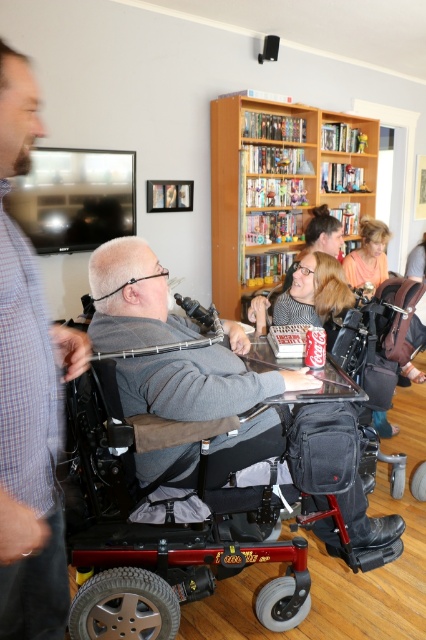
You are a photographer trying to capture a clear photo of the gray fabric wheelchair at center without the gray plaid shirt at left blocking it. What should you do?

Move to the right side of the gray plaid shirt at left so that the gray plaid shirt at left is no longer in front of the gray fabric wheelchair at center.

You are a guest at the gathering and want to move from the entrance to the gray fabric wheelchair at center without blocking the view of the wooden bookshelf at upper center. Which direction should you walk around the wheelchair?

You should walk around the gray fabric wheelchair at center to the side that is away from the wooden bookshelf at upper center since the wheelchair is in front of the bookshelf, so moving to the opposite side would keep the bookshelf visible.

You are a photographer trying to capture a group photo of the gray plaid shirt at left and the gray fabric wheelchair at center. To ensure both are in frame, should you adjust your camera to focus more to the left or the right?

The gray plaid shirt at left is positioned on the left side of the gray fabric wheelchair at center, so you should focus more to the left to include both in the frame.